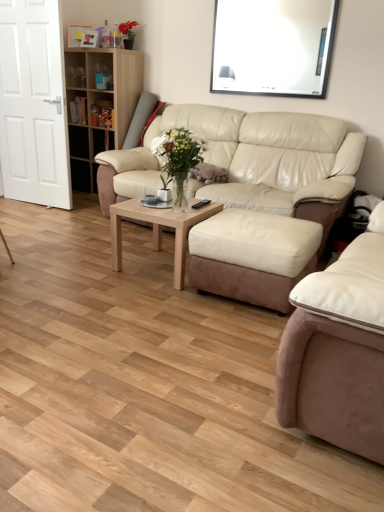
At what (x,y) coordinates should I click in order to perform the action: click on vacant area situated to the left side of white leather ottoman at center. Please return your answer as a coordinate pair (x, y). Looking at the image, I should click on (158, 298).